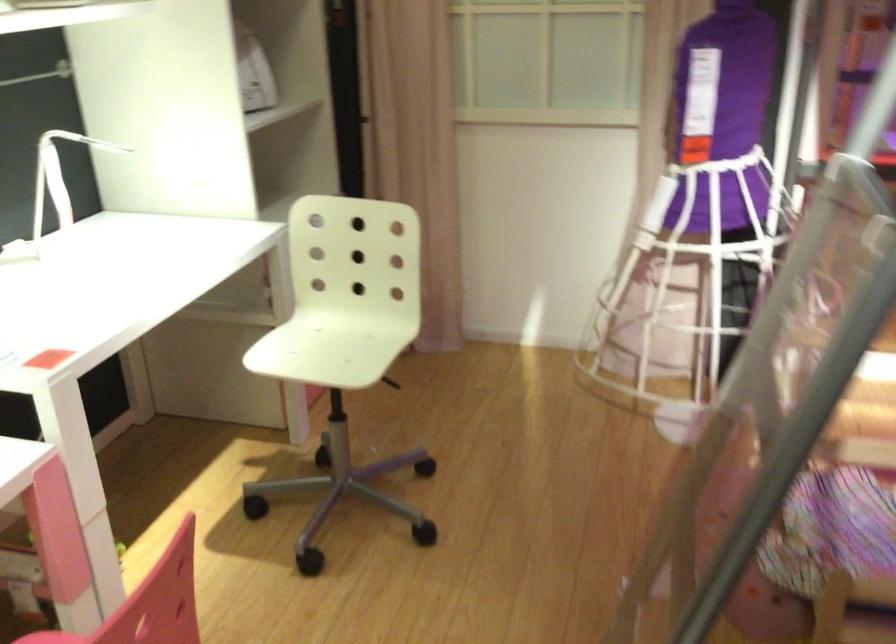
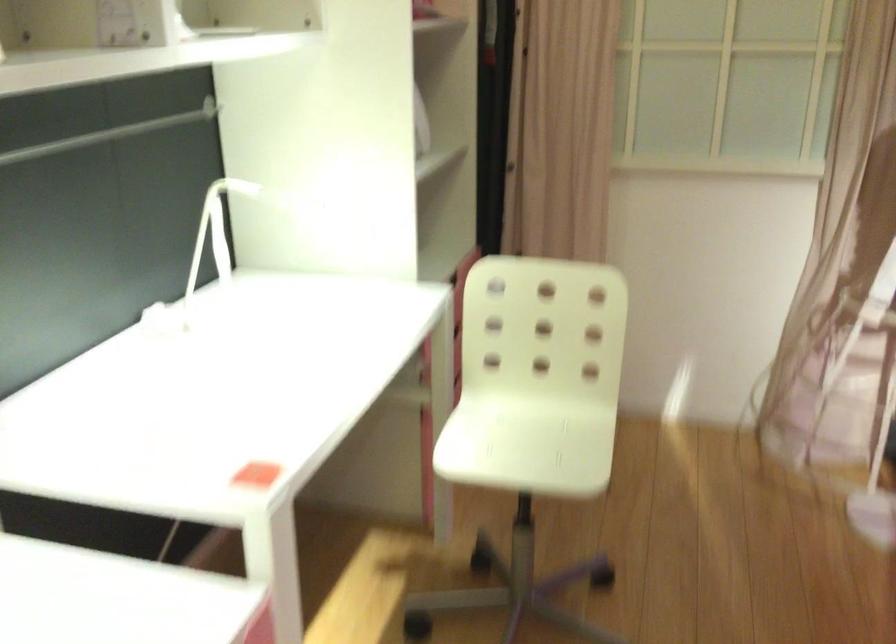
Locate, in the second image, the point that corresponds to point (307, 339) in the first image.

(495, 431)